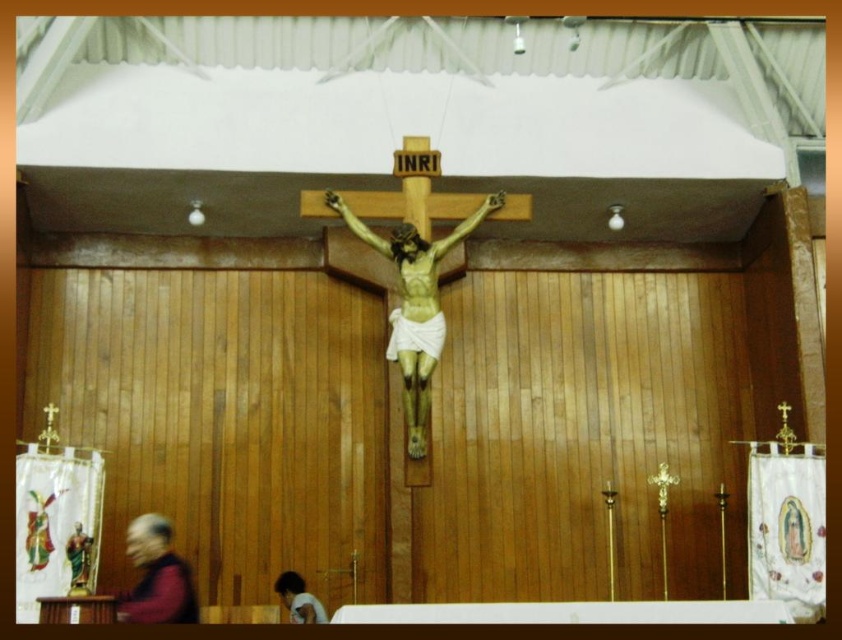
Question: Which of the following is the farthest from the observer?

Choices:
 (A) (280, 576)
 (B) (92, 545)
 (C) (352, 216)
 (D) (144, 524)

Answer: (A)

Question: Is wooden crucifix at center below golden statue at lower left?

Choices:
 (A) yes
 (B) no

Answer: (B)

Question: Which of the following is the farthest from the observer?

Choices:
 (A) (73, 531)
 (B) (429, 353)

Answer: (B)

Question: Estimate the real-world distances between objects in this image. Which object is closer to the smooth gray hair at lower left?

Choices:
 (A) golden statue at lower left
 (B) wooden crucifix at center
 (C) light brown skin at lower center

Answer: (A)

Question: In this image, where is smooth gray hair at lower left located relative to light brown skin at lower center?

Choices:
 (A) right
 (B) left

Answer: (B)

Question: Where is wooden crucifix at center located in relation to smooth gray hair at lower left in the image?

Choices:
 (A) left
 (B) right

Answer: (B)